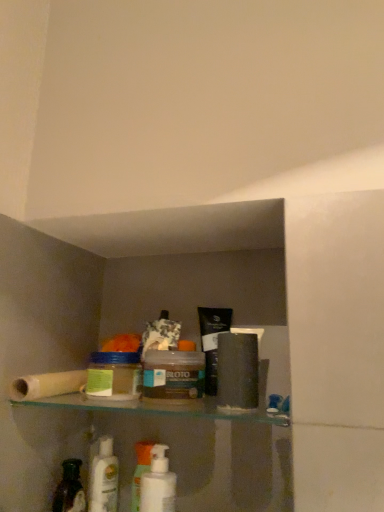
Question: Does translucent plastic roll at left have a greater height compared to white plastic mouthwash at center, the 2th mouthwash in the back-to-front sequence?

Choices:
 (A) yes
 (B) no

Answer: (B)

Question: Is translucent plastic roll at left shorter than white plastic mouthwash at center, the 2th mouthwash in the back-to-front sequence?

Choices:
 (A) no
 (B) yes

Answer: (B)

Question: Does translucent plastic roll at left have a greater width compared to white plastic mouthwash at center, positioned as the 1th mouthwash in right-to-left order?

Choices:
 (A) no
 (B) yes

Answer: (B)

Question: Is translucent plastic roll at left facing away from white plastic mouthwash at center, the 2th mouthwash in the back-to-front sequence?

Choices:
 (A) yes
 (B) no

Answer: (B)

Question: Does translucent plastic roll at left appear on the left side of white plastic mouthwash at center, which appears as the 2th mouthwash when viewed from the left?

Choices:
 (A) yes
 (B) no

Answer: (A)

Question: From a real-world perspective, is white glossy mouthwash at lower left, which is counted as the first mouthwash, starting from the back, physically located above or below white plastic pump bottle at lower center?

Choices:
 (A) above
 (B) below

Answer: (A)

Question: Which is correct: white glossy mouthwash at lower left, placed as the second mouthwash when sorted from front to back, is inside white plastic pump bottle at lower center, or outside of it?

Choices:
 (A) outside
 (B) inside

Answer: (A)

Question: Does point (109, 503) appear closer or farther from the camera than point (135, 506)?

Choices:
 (A) farther
 (B) closer

Answer: (A)

Question: From the image's perspective, is white glossy mouthwash at lower left, placed as the second mouthwash when sorted from front to back, above or below white plastic pump bottle at lower center?

Choices:
 (A) below
 (B) above

Answer: (A)

Question: From their relative heights in the image, would you say matte brown jar at center, which is the first product in right-to-left order, is taller or shorter than translucent plastic bottle at lower left?

Choices:
 (A) short
 (B) tall

Answer: (A)

Question: Based on their positions, is matte brown jar at center, the 2th product from the left, located to the left or right of translucent plastic bottle at lower left?

Choices:
 (A) right
 (B) left

Answer: (A)

Question: Is matte brown jar at center, the 2th product from the left, wider or thinner than translucent plastic bottle at lower left?

Choices:
 (A) thin
 (B) wide

Answer: (B)

Question: In terms of size, does matte brown jar at center, which is the first product in right-to-left order, appear bigger or smaller than translucent plastic bottle at lower left?

Choices:
 (A) big
 (B) small

Answer: (A)

Question: From a real-world perspective, is translucent plastic jar at center, the first product viewed from the left, physically located above or below matte brown jar at center, the 2th product from the left?

Choices:
 (A) above
 (B) below

Answer: (A)

Question: From the image's perspective, relative to matte brown jar at center, which is the first product in right-to-left order, is translucent plastic jar at center, acting as the second product starting from the right, above or below?

Choices:
 (A) above
 (B) below

Answer: (A)